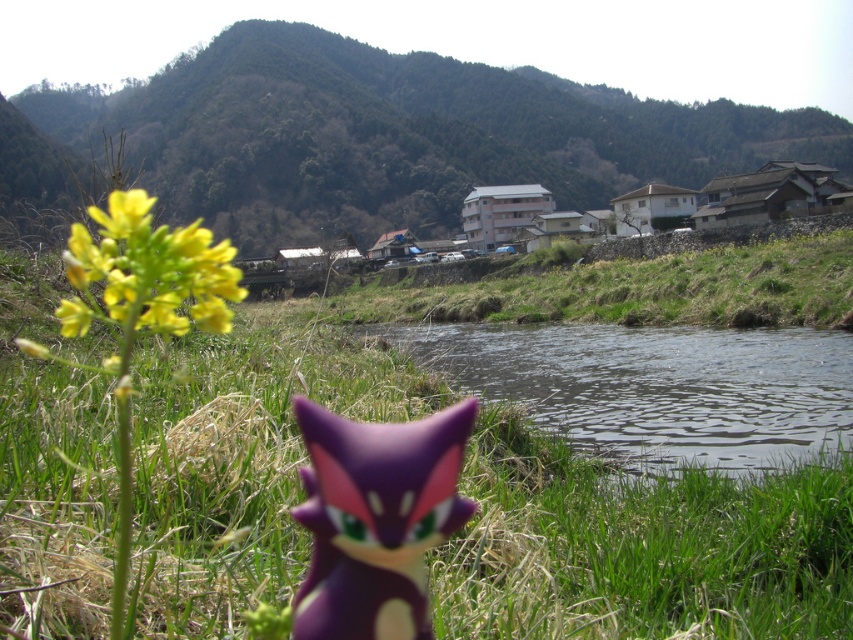
You are a photographer trying to capture the green textured hillside at upper center and the transparent water at center in a single frame. Based on their positions, which object should you adjust your camera to focus on first to ensure both are in the frame?

The green textured hillside at upper center is to the left of transparent water at center, so you should focus on the transparent water at center first to ensure both are included in the frame.